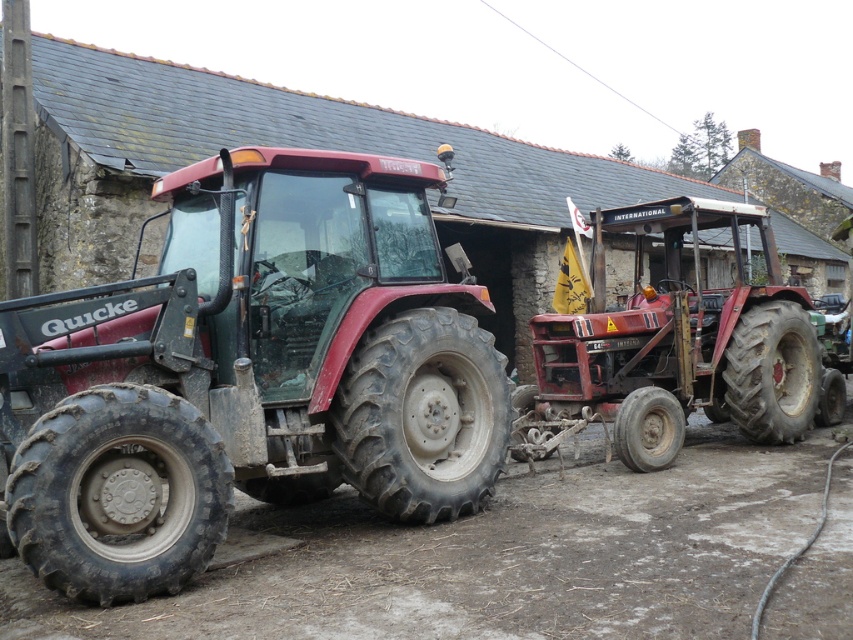
Is point (457, 484) farther from viewer compared to point (824, 390)?

No, (457, 484) is closer to viewer.

Find the location of `black rubber tire at center`. black rubber tire at center is located at coordinates (422, 416).

In order to click on black rubber tire at center in this screenshot , I will do `click(422, 416)`.

Does black rubber tire at center have a greater width compared to rubber/rough tire at right?

Incorrect, black rubber tire at center's width does not surpass rubber/rough tire at right's.

Between black rubber tire at center and rubber/rough tire at right, which one has more height?

Standing taller between the two is rubber/rough tire at right.

The image size is (853, 640). What do you see at coordinates (422, 416) in the screenshot?
I see `black rubber tire at center` at bounding box center [422, 416].

Find the location of a particular element. The image size is (853, 640). black rubber tire at center is located at coordinates (422, 416).

Consider the image. Does black rubber tire at lower left have a smaller size compared to rubber/rough tire at right?

Correct, black rubber tire at lower left occupies less space than rubber/rough tire at right.

Is the position of black rubber tire at lower left more distant than that of rubber/rough tire at right?

No.

Is point (171, 452) positioned behind point (732, 349)?

No, it is not.

Where is `black rubber tire at lower left`? This screenshot has height=640, width=853. black rubber tire at lower left is located at coordinates (119, 493).